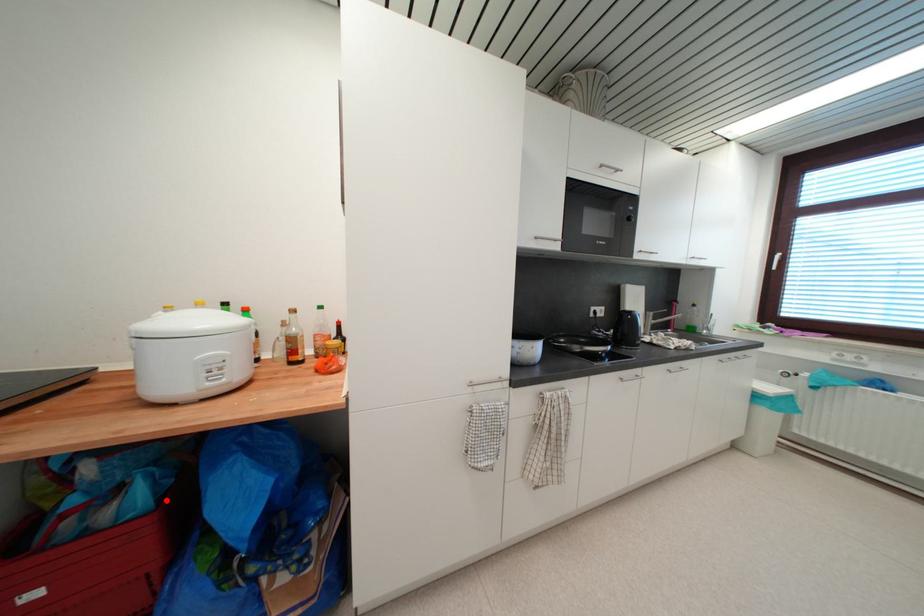
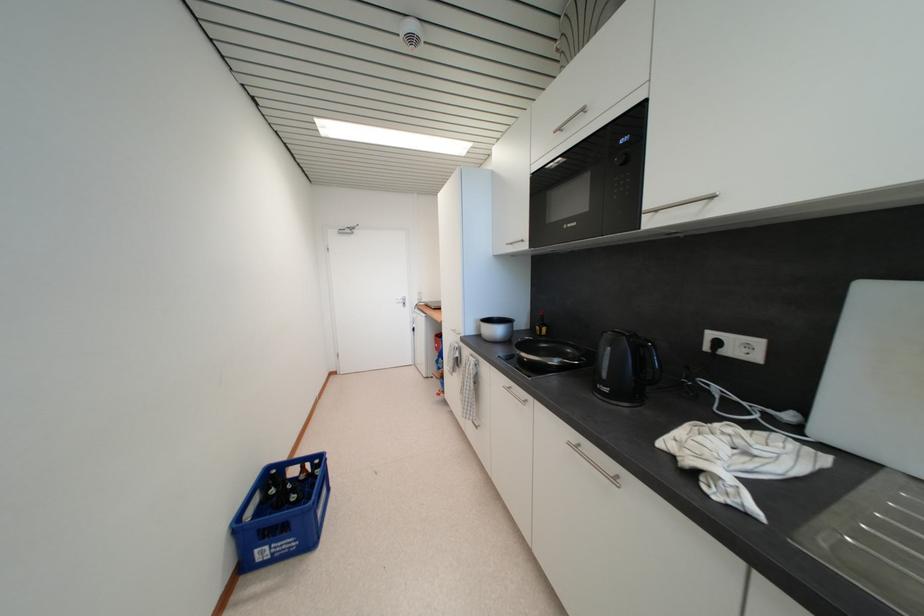
Question: I am providing you with two images of the same scene from different viewpoints. A red point is marked on the first image. At the location where the point appears in image 1, is it still visible in image 2?

Choices:
 (A) Yes
 (B) No

Answer: (B)